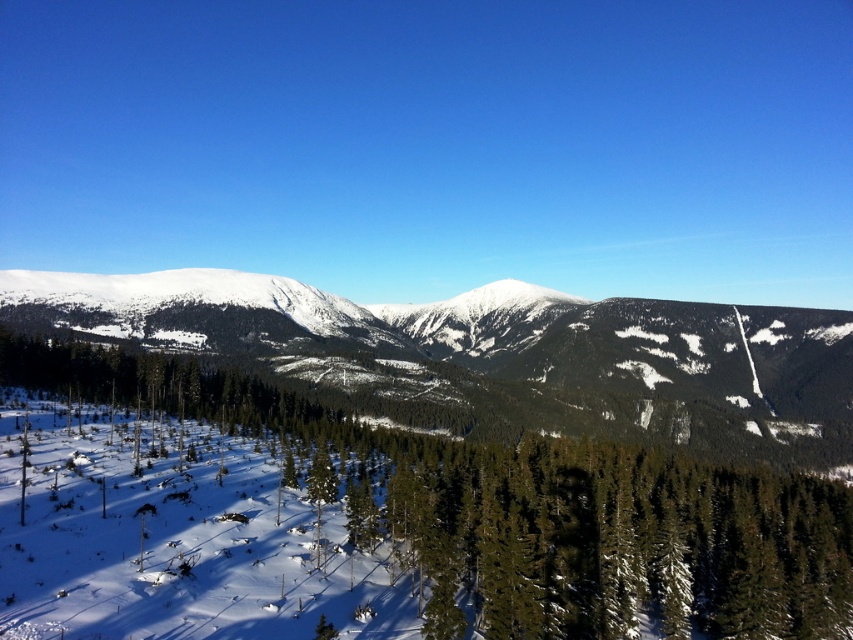
Looking at this image, does green matte tree at lower left have a lesser width compared to snowy mountain at center?

Correct, green matte tree at lower left's width is less than snowy mountain at center's.

Who is more distant from viewer, (392,477) or (321,330)?

Point (321,330)

Where is `green matte tree at lower left`? green matte tree at lower left is located at coordinates (515, 509).